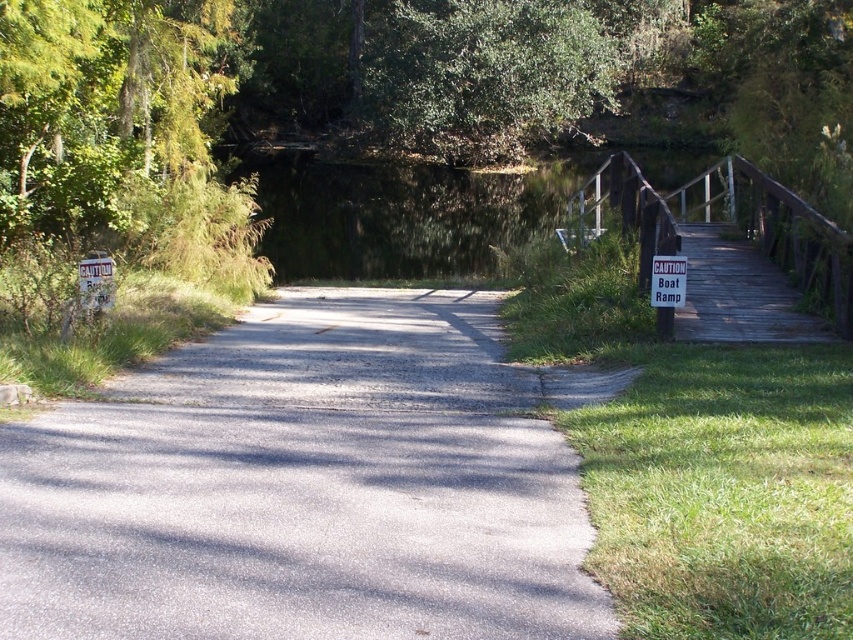
Is green leafy tree at upper center smaller than white paper sign at right?

No.

Who is more forward, [556,128] or [666,273]?

Point [666,273] is more forward.

The image size is (853, 640). Find the location of `green leafy tree at upper center`. green leafy tree at upper center is located at coordinates (480, 76).

The height and width of the screenshot is (640, 853). What do you see at coordinates (718, 234) in the screenshot?
I see `wooden bridge at right` at bounding box center [718, 234].

Where is `wooden bridge at right`? wooden bridge at right is located at coordinates (718, 234).

Where is `wooden bridge at right`? This screenshot has height=640, width=853. wooden bridge at right is located at coordinates (718, 234).

Is point (189, 589) behind point (675, 234)?

No, (189, 589) is in front of (675, 234).

Can you confirm if gray asphalt road at center is positioned below wooden bridge at right?

Yes.

This screenshot has width=853, height=640. What are the coordinates of `gray asphalt road at center` in the screenshot? It's located at (306, 484).